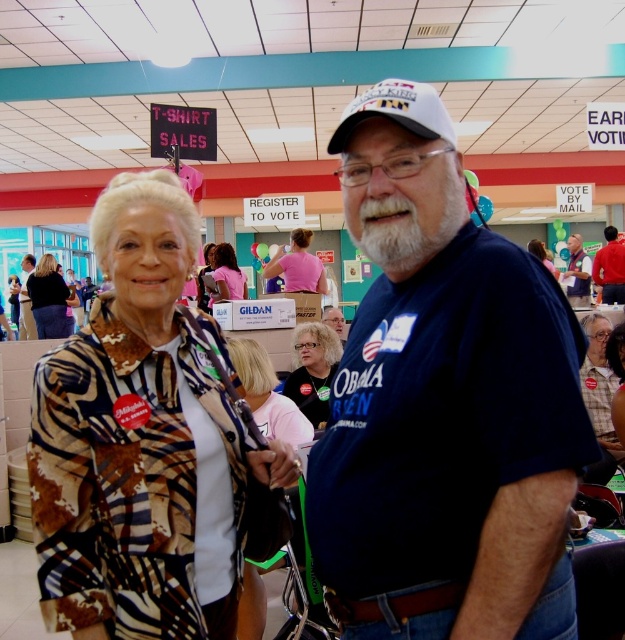
Question: Which object is the farthest from the red shirt at center?

Choices:
 (A) pink fabric shirt at center
 (B) blue cotton t-shirt at center
 (C) printed fabric blouse at center

Answer: (C)

Question: Can you confirm if printed fabric jacket at left is positioned above matte black shirt at center?

Choices:
 (A) yes
 (B) no

Answer: (B)

Question: Can you confirm if dark blue t-shirt at center is positioned to the right of matte black shirt at center?

Choices:
 (A) no
 (B) yes

Answer: (B)

Question: Which object is positioned farthest from the dark blue t-shirt at center?

Choices:
 (A) blue t-shirt at center
 (B) curly blonde hair at center

Answer: (A)

Question: Does pink fabric shirt at center have a larger size compared to red shirt at center?

Choices:
 (A) yes
 (B) no

Answer: (B)

Question: Based on their relative distances, which object is farther from the red shirt at center?

Choices:
 (A) matte pink shirt at center
 (B) printed fabric jacket at left
 (C) pink fabric at center
 (D) matte black shirt at center

Answer: (D)